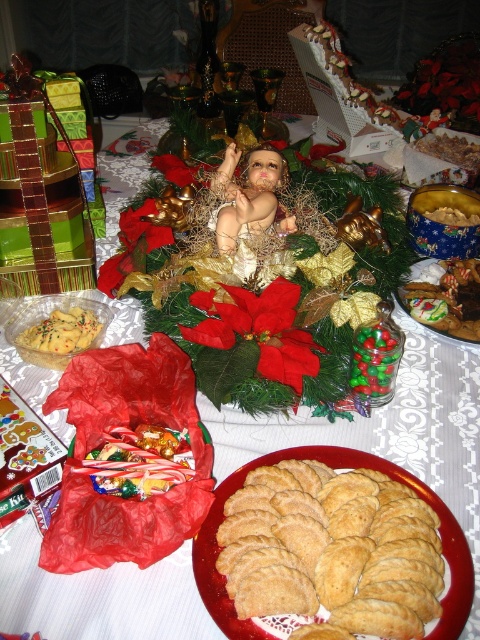
Is smooth porcelain baby at center thinner than matte yellow cookies at center-left?

No, smooth porcelain baby at center is not thinner than matte yellow cookies at center-left.

Between point (237, 237) and point (66, 346), which one is positioned in front?

Point (66, 346) is in front.

I want to click on smooth porcelain baby at center, so (250, 196).

Identify the location of smooth porcelain baby at center. The width and height of the screenshot is (480, 640). (250, 196).

Who is shorter, golden brown cookie at center or matte yellow cookies at center-left?

matte yellow cookies at center-left

Does golden brown cookie at center have a larger size compared to matte yellow cookies at center-left?

Correct, golden brown cookie at center is larger in size than matte yellow cookies at center-left.

This screenshot has height=640, width=480. I want to click on golden brown cookie at center, so click(x=332, y=550).

Between point (300, 554) and point (256, 150), which one is positioned behind?

The point (256, 150) is more distant.

Does point (336, 516) come farther from viewer compared to point (273, 157)?

No, it is not.

Does point (384, 604) lie in front of point (238, 196)?

That is True.

Locate an element on the screen. This screenshot has width=480, height=640. golden brown cookie at center is located at coordinates (332, 550).